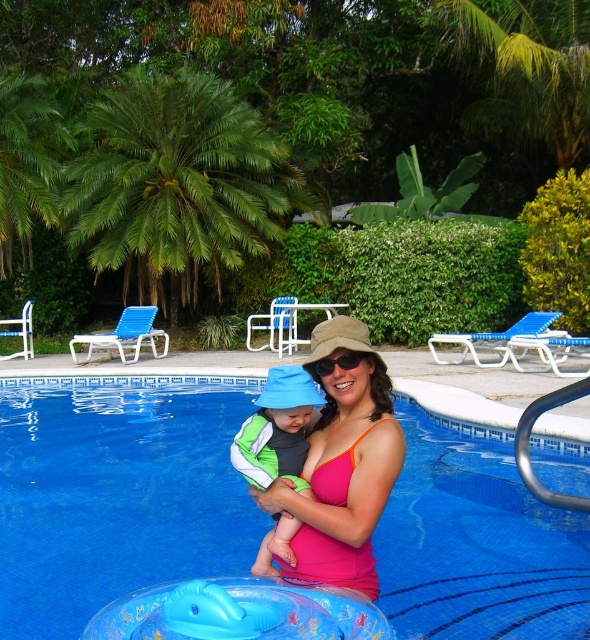
Which is above, green leafy palm tree at upper center or green fleece jacket at center?

green leafy palm tree at upper center is higher up.

Between point (584, 77) and point (273, 566), which one is positioned in front?

Point (273, 566) is more forward.

Find the location of a particular element. This screenshot has height=640, width=590. green leafy palm tree at upper center is located at coordinates (529, 65).

Identify the location of green leafy palm tree at upper center. (529, 65).

The height and width of the screenshot is (640, 590). I want to click on blue plastic pool at center, so click(x=116, y=492).

This screenshot has width=590, height=640. I want to click on blue plastic pool at center, so click(x=116, y=492).

Which is more to the left, green leafy palm tree at upper left or green leafy palm tree at upper center?

green leafy palm tree at upper left

Is point (87, 144) in front of point (513, 56)?

Yes, point (87, 144) is in front of point (513, 56).

In order to click on green leafy palm tree at upper left in this screenshot , I will do `click(175, 180)`.